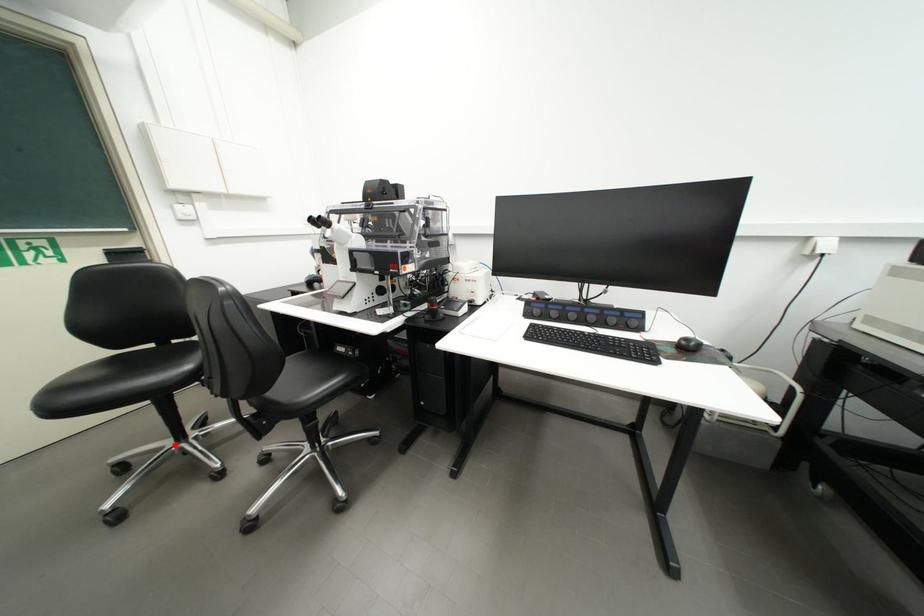
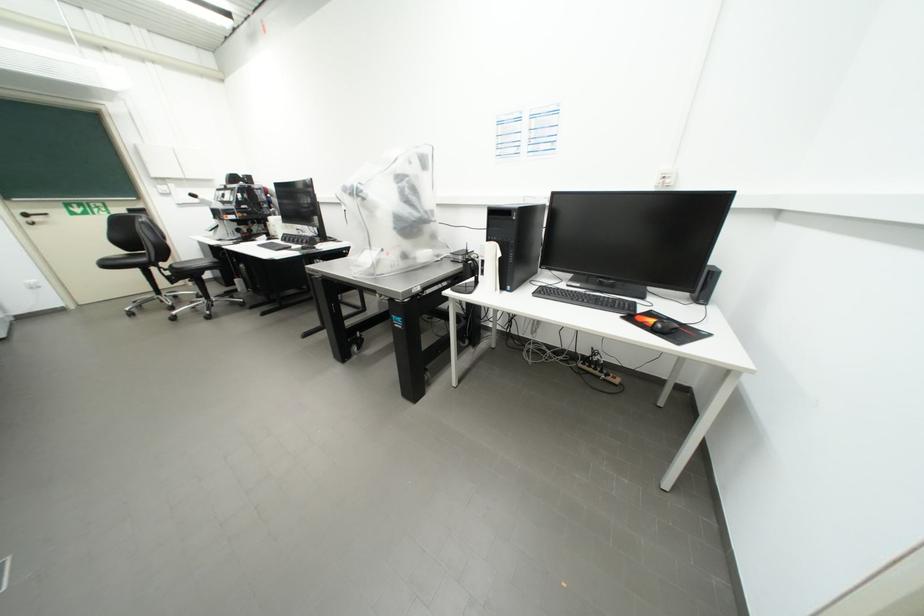
Question: I am providing you with two images of the same scene from different viewpoints. A red point is shown in image1. For the corresponding object point in image2, is it positioned nearer or farther from the camera?

Choices:
 (A) Nearer
 (B) Farther

Answer: (B)